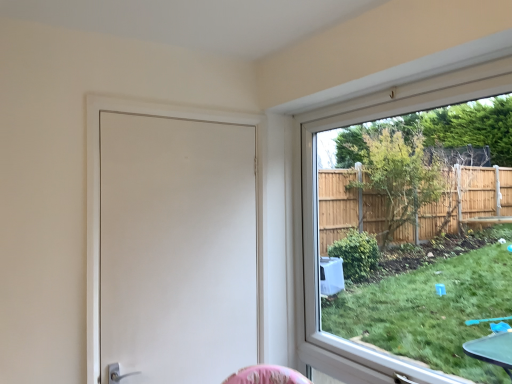
What are the coordinates of `clear glass window at upper right` in the screenshot? It's located at (316, 202).

What is the approximate height of clear glass window at upper right?

The height of clear glass window at upper right is 4.30 feet.

Consider the image. What is the approximate width of clear glass window at upper right?

clear glass window at upper right is 5.48 inches wide.

The image size is (512, 384). Describe the element at coordinates (316, 202) in the screenshot. I see `clear glass window at upper right` at that location.

What do you see at coordinates (99, 193) in the screenshot? I see `white matte door at left` at bounding box center [99, 193].

Identify the location of white matte door at left. (99, 193).

Identify the location of clear glass window at upper right. (316, 202).

Is clear glass window at upper right at the right side of white matte door at left?

Yes.

Considering the relative positions of clear glass window at upper right and white matte door at left in the image provided, is clear glass window at upper right in front of white matte door at left?

Yes, the depth of clear glass window at upper right is less than that of white matte door at left.

Does point (456, 88) appear closer or farther from the camera than point (180, 115)?

Point (456, 88) is positioned closer to the camera compared to point (180, 115).

From the image's perspective, between clear glass window at upper right and white matte door at left, which one is located above?

clear glass window at upper right, from the image's perspective.

From a real-world perspective, which is physically below, clear glass window at upper right or white matte door at left?

In real-world perspective, clear glass window at upper right is lower.

Considering the sizes of objects clear glass window at upper right and white matte door at left in the image provided, who is thinner, clear glass window at upper right or white matte door at left?

white matte door at left.

Which of these two, clear glass window at upper right or white matte door at left, stands shorter?

white matte door at left.

Which of these two, clear glass window at upper right or white matte door at left, is bigger?

Bigger between the two is clear glass window at upper right.

Would you say clear glass window at upper right is outside white matte door at left?

clear glass window at upper right is positioned outside white matte door at left.

Based on the photo, does clear glass window at upper right touch white matte door at left?

No, clear glass window at upper right is not touching white matte door at left.

Is clear glass window at upper right facing towards white matte door at left?

Yes, clear glass window at upper right is aimed at white matte door at left.

Locate an element on the screen. door above the clear glass window at upper right (from a real-world perspective) is located at coordinates (99, 193).

Can you confirm if white matte door at left is positioned to the left of clear glass window at upper right?

Yes, white matte door at left is to the left of clear glass window at upper right.

Does white matte door at left come in front of clear glass window at upper right?

That is False.

Between point (124, 101) and point (323, 123), which one is positioned behind?

The point (323, 123) is farther from the camera.

From the image's perspective, between white matte door at left and clear glass window at upper right, who is located below?

From the image's view, white matte door at left is below.

From the picture: From a real-world perspective, is white matte door at left positioned over clear glass window at upper right based on gravity?

Yes, from a real-world perspective, white matte door at left is above clear glass window at upper right.

Considering the sizes of white matte door at left and clear glass window at upper right in the image, is white matte door at left wider or thinner than clear glass window at upper right?

Considering their sizes, white matte door at left looks slimmer than clear glass window at upper right.

Does white matte door at left have a lesser height compared to clear glass window at upper right?

Correct, white matte door at left is not as tall as clear glass window at upper right.

Considering the relative sizes of white matte door at left and clear glass window at upper right in the image provided, is white matte door at left bigger than clear glass window at upper right?

No, white matte door at left is not bigger than clear glass window at upper right.

Is white matte door at left surrounding clear glass window at upper right?

No, clear glass window at upper right is not inside white matte door at left.

Are white matte door at left and clear glass window at upper right far apart?

No.

Could you tell me if white matte door at left is facing clear glass window at upper right?

No, white matte door at left does not turn towards clear glass window at upper right.

How many degrees apart are the facing directions of white matte door at left and clear glass window at upper right?

white matte door at left and clear glass window at upper right are facing 89.4 degrees away from each other.

How distant is white matte door at left from clear glass window at upper right?

They are 31.47 inches apart.

Image resolution: width=512 pixels, height=384 pixels. Identify the location of window in front of the white matte door at left. (316, 202).

In order to click on window in front of the white matte door at left in this screenshot , I will do `click(316, 202)`.

Identify the location of door below the clear glass window at upper right (from the image's perspective). The height and width of the screenshot is (384, 512). (99, 193).